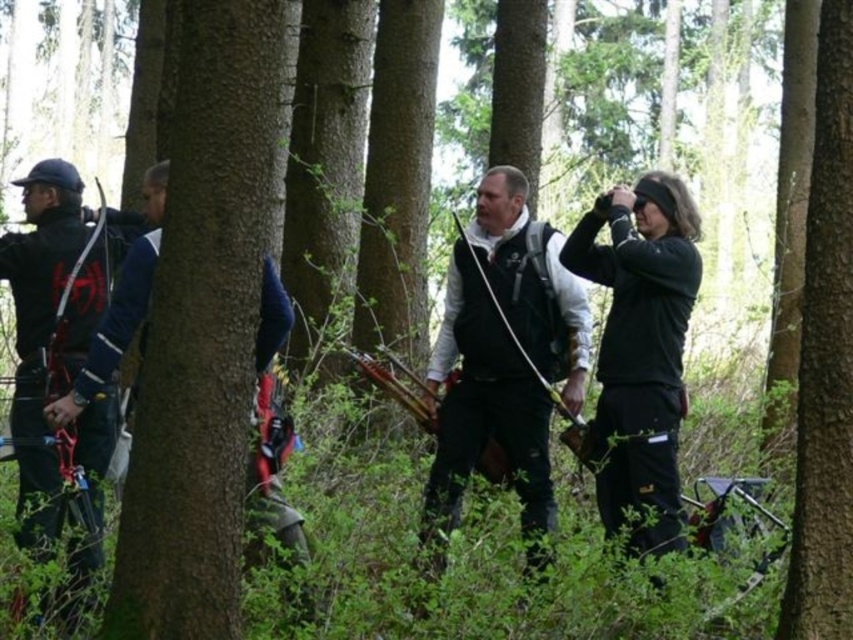
You are an archery instructor observing the group. You notice two participants wearing black clothing. One is wearing a black matte vest at center and the other a matte black jacket at left. Which participant is standing to the right of the other?

The black matte vest at center is positioned on the right side of the matte black jacket at left, so the participant wearing the black matte vest at center is standing to the right of the one wearing the matte black jacket at left.

You are an archer in the forest and need to decide which object to use as a target. The black matte jacket at right and the smooth bark tree at center are both visible. Which object is bigger and thus a better target for your arrow?

The black matte jacket at right is larger in size than the smooth bark tree at center, so it is a better target for your arrow.

You are an archer standing in the forest and see the smooth bark tree at center and the dark blue jacket at left. Which object is larger in size?

The dark blue jacket at left is larger than the smooth bark tree at center.